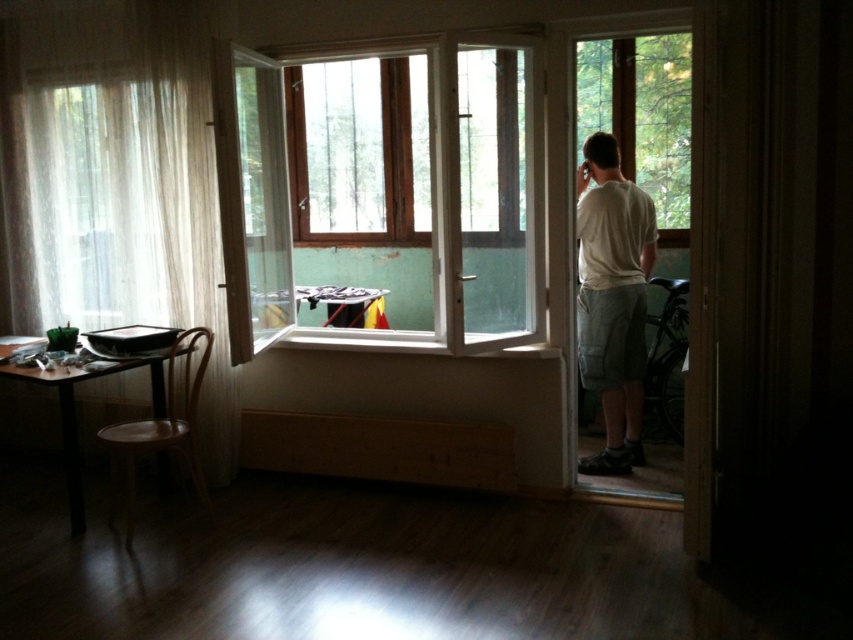
Question: Which object appears closest to the camera in this image?

Choices:
 (A) white sheer curtain at left
 (B) transparent glass door at center
 (C) white cotton shirt at right

Answer: (B)

Question: Is white sheer curtain at left further to camera compared to transparent glass door at center?

Choices:
 (A) yes
 (B) no

Answer: (A)

Question: Is wooden frame at center wider than white sheer curtain at left?

Choices:
 (A) no
 (B) yes

Answer: (B)

Question: Can you confirm if wooden frame at center is positioned to the left of white sheer curtain at left?

Choices:
 (A) yes
 (B) no

Answer: (B)

Question: Which of the following is the farthest from the observer?

Choices:
 (A) white cotton shirt at right
 (B) white sheer curtain at left
 (C) wooden frame at center
 (D) transparent glass door at center

Answer: (B)

Question: Among these points, which one is farthest from the camera?

Choices:
 (A) (590, 269)
 (B) (236, 237)
 (C) (125, 10)

Answer: (A)